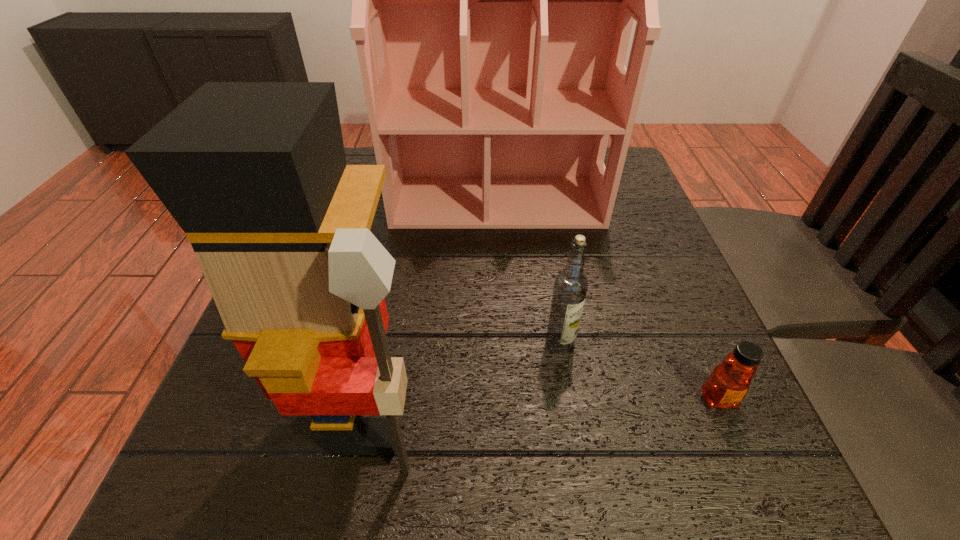
Image resolution: width=960 pixels, height=540 pixels. Identify the location of vacant space that's between the nutcracker and the third tallest object. click(x=466, y=379).

At what (x,y) coordinates should I click in order to perform the action: click on blank region between the nutcracker and the dollhouse. Please return your answer as a coordinate pair (x, y). This screenshot has height=540, width=960. Looking at the image, I should click on (434, 308).

Locate an element on the screen. free space between the shortest object and the vodka is located at coordinates (639, 371).

The width and height of the screenshot is (960, 540). Find the location of `empty space that is in between the rightmost object and the nutcracker`. empty space that is in between the rightmost object and the nutcracker is located at coordinates (544, 407).

The width and height of the screenshot is (960, 540). I want to click on free spot between the nutcracker and the dollhouse, so click(434, 308).

Find the location of a particular element. Image resolution: width=960 pixels, height=540 pixels. unoccupied position between the second shortest object and the honey is located at coordinates (639, 371).

What are the coordinates of `free point between the honey and the dollhouse` in the screenshot? It's located at (608, 300).

You are a GUI agent. You are given a task and a screenshot of the screen. Output one action in this format:
    pyautogui.click(x=<x>, y=<y>)
    Task: Click on the empty location between the rightmost object and the dollhouse
    The image size is (960, 540).
    Given the screenshot: What is the action you would take?
    pyautogui.click(x=608, y=300)

Locate an element on the screen. Image resolution: width=960 pixels, height=540 pixels. free space between the second shortest object and the nutcracker is located at coordinates (466, 379).

I want to click on free space that is in between the shortest object and the dollhouse, so click(608, 300).